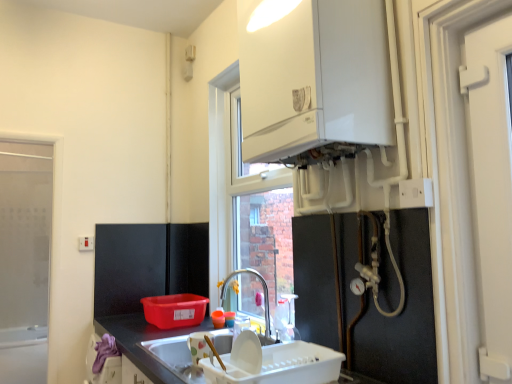
You are a GUI agent. You are given a task and a screenshot of the screen. Output one action in this format:
    pyautogui.click(x=<x>, y=<y>)
    Task: Click on the transparent glass window at left
    The image size is (512, 384).
    Given the screenshot: What is the action you would take?
    [24, 260]

Where is `metallic silver pipes at lower right, acting as the 2th appliance starting from the bottom`? metallic silver pipes at lower right, acting as the 2th appliance starting from the bottom is located at coordinates (403, 309).

The width and height of the screenshot is (512, 384). What do you see at coordinates (274, 363) in the screenshot?
I see `white plastic dish rack at lower center, the 1th appliance in the bottom-to-top sequence` at bounding box center [274, 363].

You are a GUI agent. You are given a task and a screenshot of the screen. Output one action in this format:
    pyautogui.click(x=<x>, y=<y>)
    Task: Click on the transparent glass window at left
    The image size is (512, 384).
    Given the screenshot: What is the action you would take?
    pyautogui.click(x=24, y=260)

From a real-world perspective, between transparent glass window at left and metallic silver pipes at lower right, acting as the 2th appliance starting from the bottom, who is vertically higher?

From a 3D spatial view, transparent glass window at left is above.

Is transparent glass window at left inside the boundaries of metallic silver pipes at lower right, the 1th appliance when ordered from top to bottom, or outside?

transparent glass window at left cannot be found inside metallic silver pipes at lower right, the 1th appliance when ordered from top to bottom.

Considering the relative sizes of transparent glass window at left and metallic silver pipes at lower right, the 1th appliance when ordered from top to bottom, in the image provided, is transparent glass window at left wider than metallic silver pipes at lower right, the 1th appliance when ordered from top to bottom,?

Yes, transparent glass window at left is wider than metallic silver pipes at lower right, the 1th appliance when ordered from top to bottom.

Between transparent glass window at left and metallic silver pipes at lower right, acting as the 2th appliance starting from the bottom, which one appears on the right side from the viewer's perspective?

metallic silver pipes at lower right, acting as the 2th appliance starting from the bottom.

Between white plastic electrical outlet at upper right, the 2th electric outlet viewed from the left, and silver metallic faucet at center, which one appears on the right side from the viewer's perspective?

From the viewer's perspective, white plastic electrical outlet at upper right, the 2th electric outlet viewed from the left, appears more on the right side.

From the image's perspective, is white plastic electrical outlet at upper right, placed as the 1th electric outlet when sorted from front to back, under silver metallic faucet at center?

No.

Is white plastic electrical outlet at upper right, which ranks as the 2th electric outlet in bottom-to-top order, surrounding silver metallic faucet at center?

No.

Who is taller, white plastic electrical outlet at upper right, positioned as the 1th electric outlet in right-to-left order, or silver metallic faucet at center?

silver metallic faucet at center.

Does metallic silver pipes at lower right, acting as the 2th appliance starting from the bottom, have a lesser height compared to white glossy boiler at upper center?

Yes, metallic silver pipes at lower right, acting as the 2th appliance starting from the bottom, is shorter than white glossy boiler at upper center.

Is metallic silver pipes at lower right, the 1th appliance when ordered from top to bottom, positioned with its back to white glossy boiler at upper center?

metallic silver pipes at lower right, the 1th appliance when ordered from top to bottom, does not have its back to white glossy boiler at upper center.

Considering the sizes of objects metallic silver pipes at lower right, the 1th appliance when ordered from top to bottom, and white glossy boiler at upper center in the image provided, who is bigger, metallic silver pipes at lower right, the 1th appliance when ordered from top to bottom, or white glossy boiler at upper center?

white glossy boiler at upper center.

From the picture: How many degrees apart are the facing directions of metallic silver pipes at lower right, acting as the 2th appliance starting from the bottom, and white glossy boiler at upper center?

They differ by 1.68 degrees in their facing directions.

Considering the relative sizes of white plastic dish rack at lower center, acting as the 2th appliance starting from the top, and white glossy boiler at upper center in the image provided, is white plastic dish rack at lower center, acting as the 2th appliance starting from the top, taller than white glossy boiler at upper center?

No, white plastic dish rack at lower center, acting as the 2th appliance starting from the top, is not taller than white glossy boiler at upper center.

Is white glossy boiler at upper center inside white plastic dish rack at lower center, acting as the 2th appliance starting from the top?

No, white glossy boiler at upper center is not inside white plastic dish rack at lower center, acting as the 2th appliance starting from the top.

Is white plastic dish rack at lower center, the 1th appliance in the bottom-to-top sequence, further to camera compared to white glossy boiler at upper center?

No, it is in front of white glossy boiler at upper center.

In the image, is white plastic dish rack at lower center, acting as the 2th appliance starting from the top, positioned in front of or behind white plastic electrical outlet at upper right, marked as the first electric outlet in a top-to-bottom arrangement?

In the image, white plastic dish rack at lower center, acting as the 2th appliance starting from the top, appears in front of white plastic electrical outlet at upper right, marked as the first electric outlet in a top-to-bottom arrangement.

Based on the photo, considering the positions of objects white plastic dish rack at lower center, acting as the 2th appliance starting from the top, and white plastic electrical outlet at upper right, arranged as the second electric outlet when viewed from the back, in the image provided, who is more to the left, white plastic dish rack at lower center, acting as the 2th appliance starting from the top, or white plastic electrical outlet at upper right, arranged as the second electric outlet when viewed from the back,?

Positioned to the left is white plastic dish rack at lower center, acting as the 2th appliance starting from the top.

Between white plastic dish rack at lower center, acting as the 2th appliance starting from the top, and white plastic electrical outlet at upper right, which ranks as the 2th electric outlet in bottom-to-top order, which one has smaller size?

Smaller between the two is white plastic electrical outlet at upper right, which ranks as the 2th electric outlet in bottom-to-top order.

Does white plastic dish rack at lower center, acting as the 2th appliance starting from the top, have a lesser width compared to white plastic electrical outlet at upper right, the 2th electric outlet viewed from the left?

No, white plastic dish rack at lower center, acting as the 2th appliance starting from the top, is not thinner than white plastic electrical outlet at upper right, the 2th electric outlet viewed from the left.

Would you consider white matte door at right to be distant from white plastic electric outlet at upper left, marked as the 2th electric outlet in a right-to-left arrangement?

Indeed, white matte door at right is not near white plastic electric outlet at upper left, marked as the 2th electric outlet in a right-to-left arrangement.

Relative to white plastic electric outlet at upper left, the 1th electric outlet from the back, is white matte door at right in front or behind?

Visually, white matte door at right is located in front of white plastic electric outlet at upper left, the 1th electric outlet from the back.

In order to click on door above the white plastic electric outlet at upper left, placed as the 1th electric outlet when sorted from bottom to top (from a real-world perspective) in this screenshot , I will do `click(490, 186)`.

Do you think white matte door at right is within white plastic electric outlet at upper left, marked as the 2th electric outlet in a right-to-left arrangement, or outside of it?

The correct answer is: outside.

Is white plastic electric outlet at upper left, the second electric outlet positioned from the top, inside or outside of white glossy boiler at upper center?

white plastic electric outlet at upper left, the second electric outlet positioned from the top, cannot be found inside white glossy boiler at upper center.

Looking at this image, is white plastic electric outlet at upper left, the 1th electric outlet from the back, positioned before white glossy boiler at upper center?

No, white plastic electric outlet at upper left, the 1th electric outlet from the back, is further to the viewer.

From the image's perspective, relative to white glossy boiler at upper center, is white plastic electric outlet at upper left, the second electric outlet positioned from the top, above or below?

From the image's perspective, white plastic electric outlet at upper left, the second electric outlet positioned from the top, appears below white glossy boiler at upper center.

Which of these two, white plastic electric outlet at upper left, the second electric outlet positioned from the top, or white glossy boiler at upper center, stands taller?

white glossy boiler at upper center is taller.

The image size is (512, 384). I want to click on appliance that is the 1st object located in front of the transparent glass window at left, so click(x=403, y=309).

At what (x,y) coordinates should I click in order to perform the action: click on the 2nd electric outlet above the silver metallic faucet at center (from the image's perspective). Please return your answer as a coordinate pair (x, y). Looking at the image, I should click on (416, 193).

Looking at the image, which one is located closer to metallic silver pipes at lower right, the 1th appliance when ordered from top to bottom, white plastic electric outlet at upper left, the second electric outlet positioned from the top, or silver metallic faucet at center?

Based on the image, silver metallic faucet at center appears to be nearer to metallic silver pipes at lower right, the 1th appliance when ordered from top to bottom.

From the image, which object appears to be farther from transparent glass window at left, white plastic electrical outlet at upper right, arranged as the second electric outlet when viewed from the back, or white plastic dish rack at lower center, the 1th appliance in the bottom-to-top sequence?

white plastic electrical outlet at upper right, arranged as the second electric outlet when viewed from the back, is further to transparent glass window at left.

Estimate the real-world distances between objects in this image. Which object is further from metallic silver pipes at lower right, the 1th appliance when ordered from top to bottom, white matte door at right or silver metallic faucet at center?

silver metallic faucet at center lies further to metallic silver pipes at lower right, the 1th appliance when ordered from top to bottom, than the other object.

Looking at the image, which one is located further to white plastic dish rack at lower center, the 1th appliance in the bottom-to-top sequence, silver metallic faucet at center or transparent glass window at left?

transparent glass window at left is positioned further to the anchor white plastic dish rack at lower center, the 1th appliance in the bottom-to-top sequence.

Estimate the real-world distances between objects in this image. Which object is closer to metallic silver pipes at lower right, acting as the 2th appliance starting from the bottom, transparent glass window at left or silver metallic faucet at center?

Based on the image, silver metallic faucet at center appears to be nearer to metallic silver pipes at lower right, acting as the 2th appliance starting from the bottom.

Based on their spatial positions, is white matte door at right or white plastic electrical outlet at upper right, marked as the first electric outlet in a top-to-bottom arrangement, closer to silver metallic faucet at center?

white plastic electrical outlet at upper right, marked as the first electric outlet in a top-to-bottom arrangement.

When comparing their distances from white matte door at right, does transparent glass window at left or white glossy boiler at upper center seem closer?

The object closer to white matte door at right is white glossy boiler at upper center.

Looking at this image, looking at the image, which one is located closer to transparent glass window at left, white matte door at right or white plastic dish rack at lower center, acting as the 2th appliance starting from the top?

white plastic dish rack at lower center, acting as the 2th appliance starting from the top.

Image resolution: width=512 pixels, height=384 pixels. I want to click on tap between transparent glass window at left and white matte door at right from left to right, so click(263, 290).

You are a GUI agent. You are given a task and a screenshot of the screen. Output one action in this format:
    pyautogui.click(x=<x>, y=<y>)
    Task: Click on the tap located between white plastic electric outlet at upper left, marked as the 2th electric outlet in a right-to-left arrangement, and metallic silver pipes at lower right, acting as the 2th appliance starting from the bottom, in the left-right direction
    The image size is (512, 384).
    Given the screenshot: What is the action you would take?
    pyautogui.click(x=263, y=290)

Where is `appliance that lies between white matte door at right and white plastic dish rack at lower center, the 1th appliance in the bottom-to-top sequence, from top to bottom`? This screenshot has width=512, height=384. appliance that lies between white matte door at right and white plastic dish rack at lower center, the 1th appliance in the bottom-to-top sequence, from top to bottom is located at coordinates (403, 309).

At what (x,y) coordinates should I click in order to perform the action: click on door between white glossy boiler at upper center and white plastic dish rack at lower center, the 1th appliance in the bottom-to-top sequence, from top to bottom. Please return your answer as a coordinate pair (x, y). The height and width of the screenshot is (384, 512). Looking at the image, I should click on (490, 186).